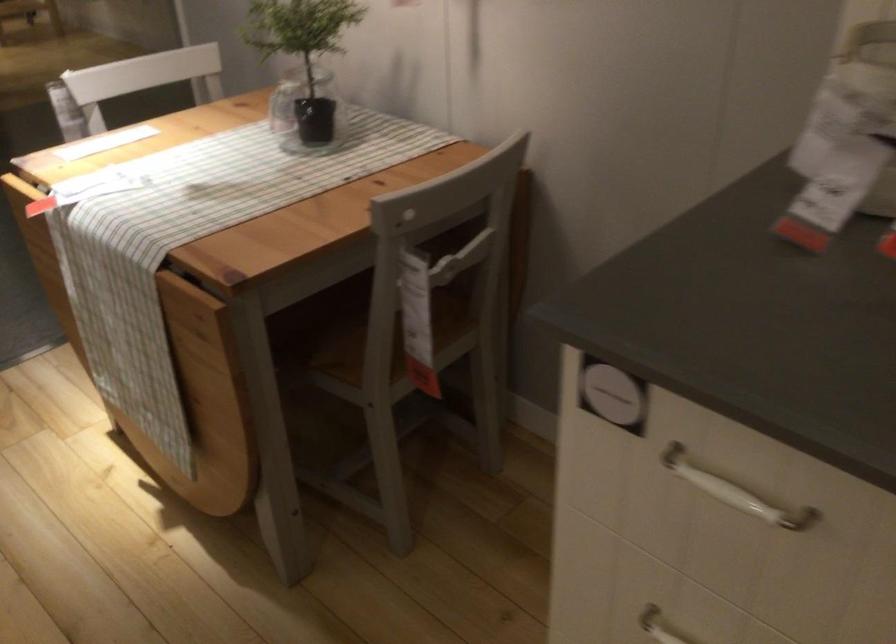
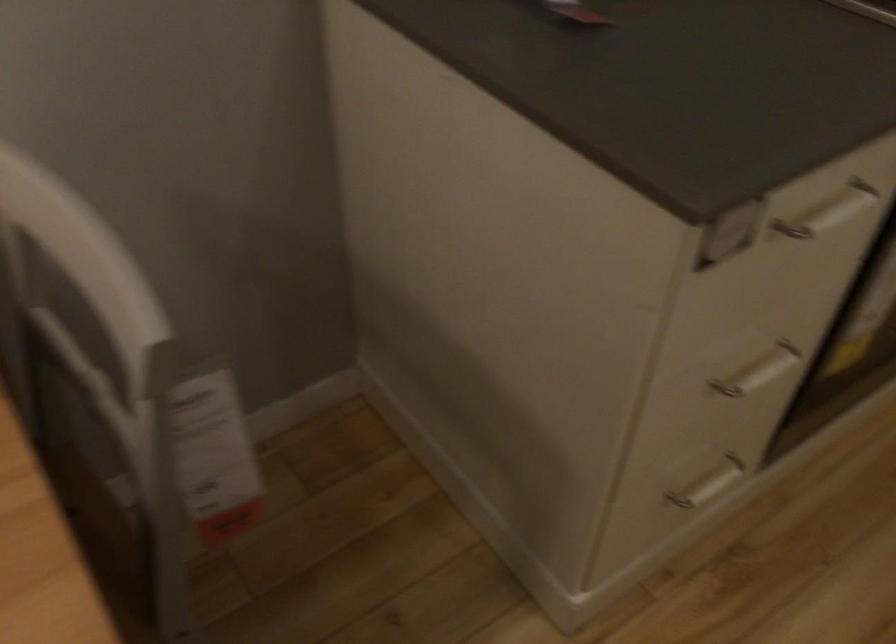
The first image is from the beginning of the video and the second image is from the end. How did the camera likely rotate when shooting the video?

The camera rotated toward right-down.